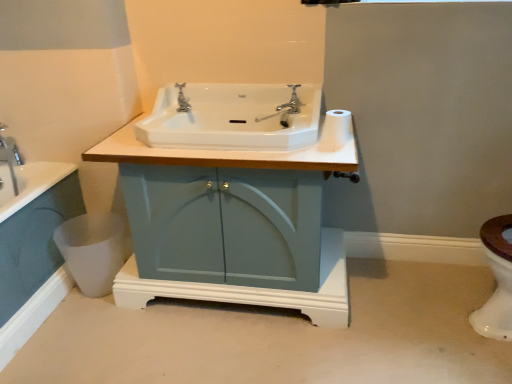
Find the location of a particular element. free spot to the right of silver metallic faucet at center is located at coordinates (225, 117).